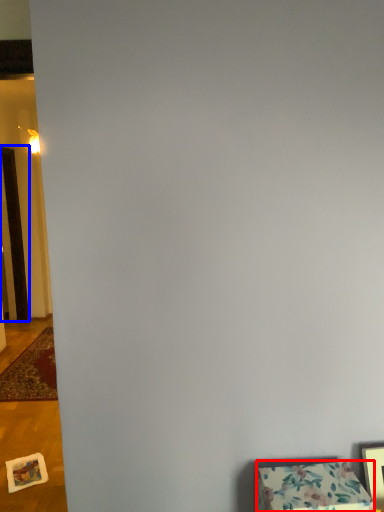
Question: Which of the following is the farthest to the observer, furniture (highlighted by a red box) or door (highlighted by a blue box)?

Choices:
 (A) furniture
 (B) door

Answer: (B)